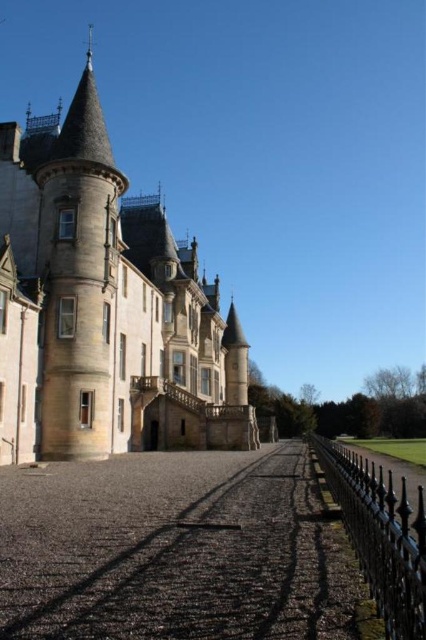
You are standing at the entrance of the brown stone castle at center. Looking towards the black wrought iron fence on the right side of the pathway, which direction is the fence relative to the castle?

The black wrought iron fence on the right side of the pathway is to the right of the brown stone castle at center.

From the picture: You are standing at point A located at coordinates (114, 300). What object is exactly at your current location?

The brown stone castle at center is exactly at point A located at coordinates (114, 300).